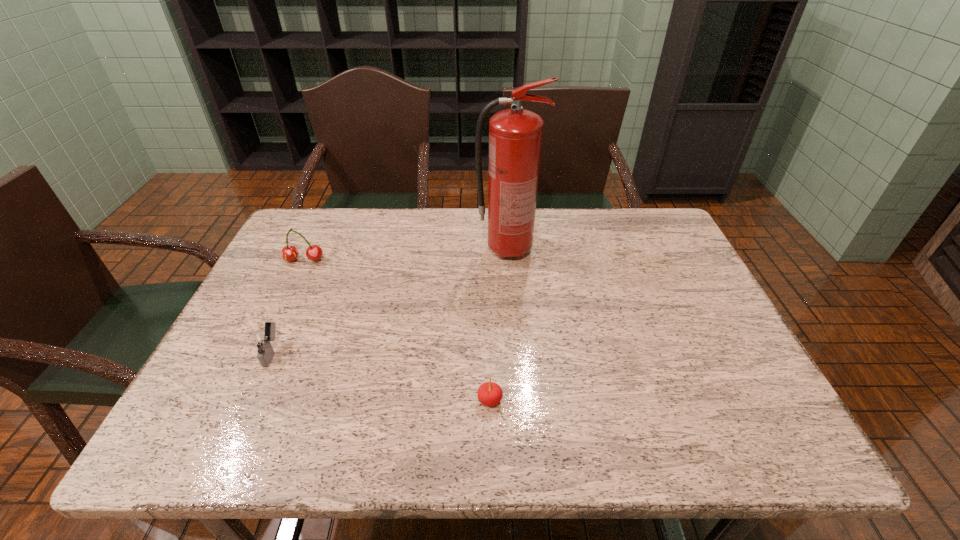
Find the location of `the tallest object`. the tallest object is located at coordinates (515, 135).

In order to click on the taller cherry in this screenshot , I will do `click(289, 253)`.

Image resolution: width=960 pixels, height=540 pixels. I want to click on the second tallest object, so click(289, 253).

Find the location of a particular element. the second nearest object is located at coordinates (260, 340).

You are a GUI agent. You are given a task and a screenshot of the screen. Output one action in this format:
    pyautogui.click(x=<x>, y=<y>)
    Task: Click on the nearer cherry
    
    Given the screenshot: What is the action you would take?
    pyautogui.click(x=489, y=393)

Locate an element on the screen. The width and height of the screenshot is (960, 540). the shorter cherry is located at coordinates (489, 393).

You are a GUI agent. You are given a task and a screenshot of the screen. Output one action in this format:
    pyautogui.click(x=<x>, y=<y>)
    Task: Click on the free region located on the handle side the tallest object
    
    Given the screenshot: What is the action you would take?
    pyautogui.click(x=628, y=250)

Locate an element on the screen. This screenshot has width=960, height=540. vacant area situated 0.170m with stems pointing upwards on the third shortest object is located at coordinates [x=281, y=308].

Identify the location of blank space located on the back of the third farthest object. This screenshot has height=540, width=960. (293, 308).

Identify the location of free space located on the back of the right cherry. (490, 371).